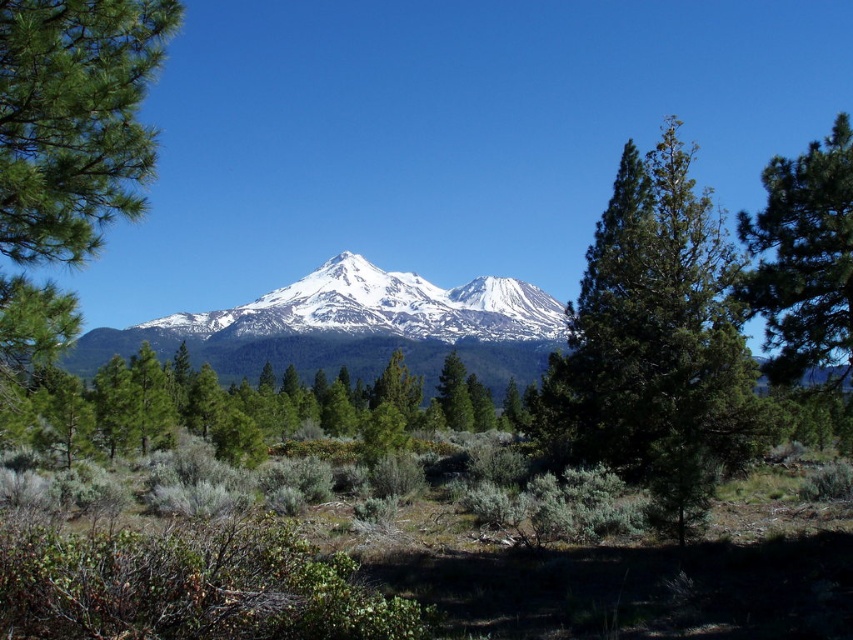
Question: Can you confirm if green textured tree at center is positioned above green textured pine tree at right?

Choices:
 (A) no
 (B) yes

Answer: (B)

Question: Is green textured tree at center behind green textured pine tree at right?

Choices:
 (A) yes
 (B) no

Answer: (B)

Question: Is green textured tree at center behind white snow-covered mountain range at center?

Choices:
 (A) yes
 (B) no

Answer: (A)

Question: Among these objects, which one is farthest from the camera?

Choices:
 (A) white snow-covered mountain range at center
 (B) green matte tree at center

Answer: (A)

Question: Estimate the real-world distances between objects in this image. Which object is closer to the green textured pine tree at right?

Choices:
 (A) green matte tree at center
 (B) green textured tree at center

Answer: (B)

Question: Which object is farther from the camera taking this photo?

Choices:
 (A) green matte tree at center
 (B) green textured tree at center

Answer: (B)